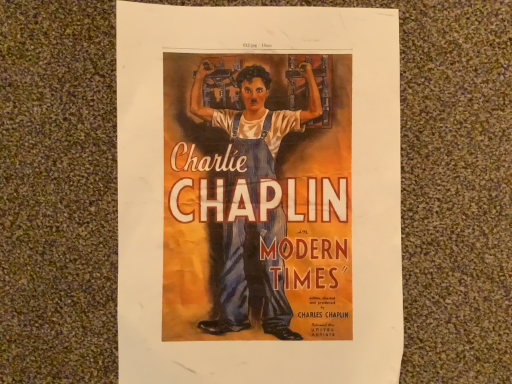
Find the location of a particular element. denim overalls at center is located at coordinates (258, 198).

What do you see at coordinates (258, 198) in the screenshot? I see `denim overalls at center` at bounding box center [258, 198].

Identify the location of denim overalls at center. (258, 198).